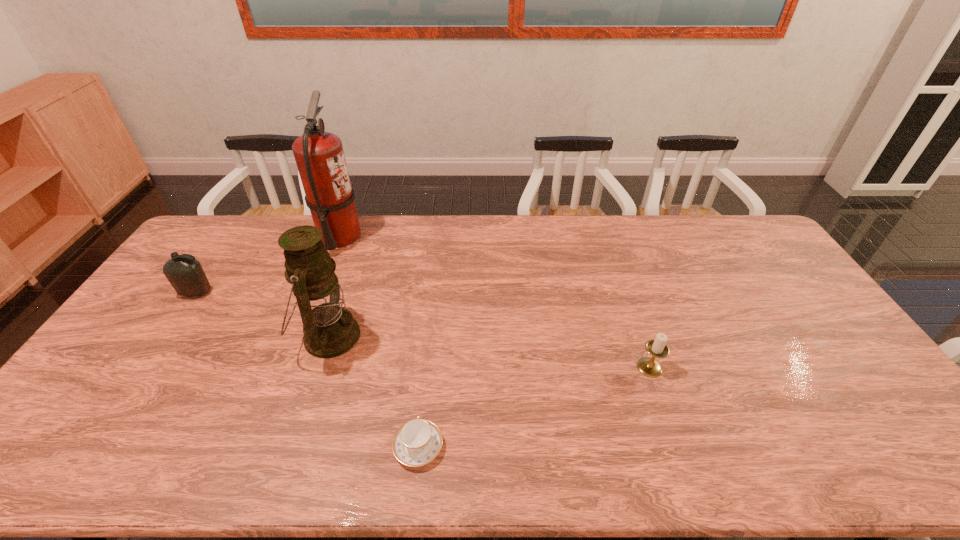
You are a GUI agent. You are given a task and a screenshot of the screen. Output one action in this format:
    pyautogui.click(x=<x>, y=<y>)
    Task: Click on the unoccupied position between the second shortest object and the third tallest object
    
    Given the screenshot: What is the action you would take?
    pyautogui.click(x=422, y=330)

Identify the location of the fourth closest object to the second farthest object. (657, 347).

Find the location of a particular element. the second closest object to the bottle is located at coordinates (330, 330).

You are a GUI agent. You are given a task and a screenshot of the screen. Output one action in this format:
    pyautogui.click(x=<x>, y=<y>)
    Task: Click on the free space in the image that satisfies the following two spatial constraints: 1. on the side with the handle of the teacup; 2. on the left side of the fourth tallest object
    This screenshot has height=540, width=960.
    Given the screenshot: What is the action you would take?
    pyautogui.click(x=427, y=367)

Locate an element on the screen. The width and height of the screenshot is (960, 540). free space that satisfies the following two spatial constraints: 1. toward the nozzle of the farthest object; 2. on the side with the handle of the shortest object is located at coordinates (257, 447).

At what (x,y) coordinates should I click in order to perform the action: click on vacant area in the image that satisfies the following two spatial constraints: 1. toward the nozzle of the oil lamp; 2. on the left side of the farthest object. Please return your answer as a coordinate pair (x, y). The image size is (960, 540). Looking at the image, I should click on (300, 336).

This screenshot has height=540, width=960. I want to click on vacant region that satisfies the following two spatial constraints: 1. toward the nozzle of the fire extinguisher; 2. on the back side of the fourth shortest object, so click(x=300, y=336).

The image size is (960, 540). Find the location of `free location that satisfies the following two spatial constraints: 1. toward the nozzle of the farthest object; 2. on the right side of the rightmost object`. free location that satisfies the following two spatial constraints: 1. toward the nozzle of the farthest object; 2. on the right side of the rightmost object is located at coordinates (288, 367).

Find the location of a particular element. Image resolution: width=960 pixels, height=540 pixels. vacant space that satisfies the following two spatial constraints: 1. on the front side of the second tallest object; 2. on the right side of the third tallest object is located at coordinates (166, 336).

Find the location of a particular element. The height and width of the screenshot is (540, 960). free location that satisfies the following two spatial constraints: 1. toward the nozzle of the rightmost object; 2. on the left side of the farthest object is located at coordinates (288, 367).